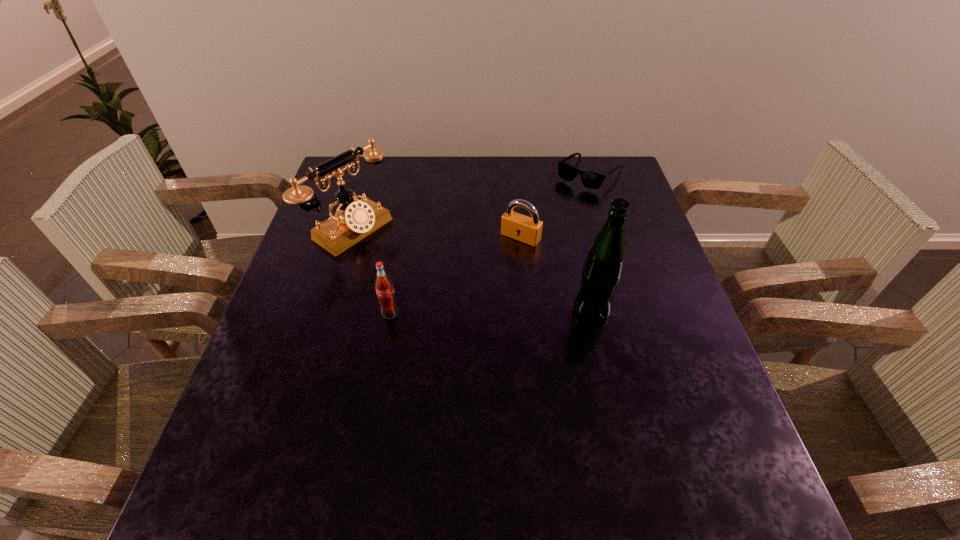
You are a GUI agent. You are given a task and a screenshot of the screen. Output one action in this format:
    pyautogui.click(x=<x>, y=<y>)
    Task: Click on the object that is the fourth closest to the fourth shortest object
    
    Given the screenshot: What is the action you would take?
    pyautogui.click(x=592, y=180)